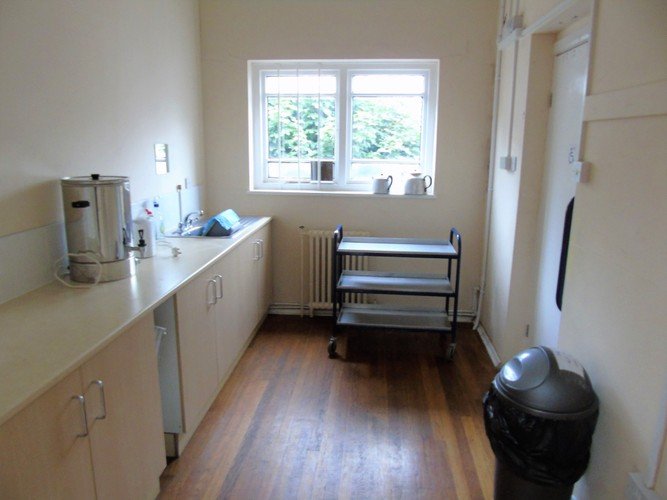
What are the coordinates of `sink` in the screenshot? It's located at (199, 227), (189, 231).